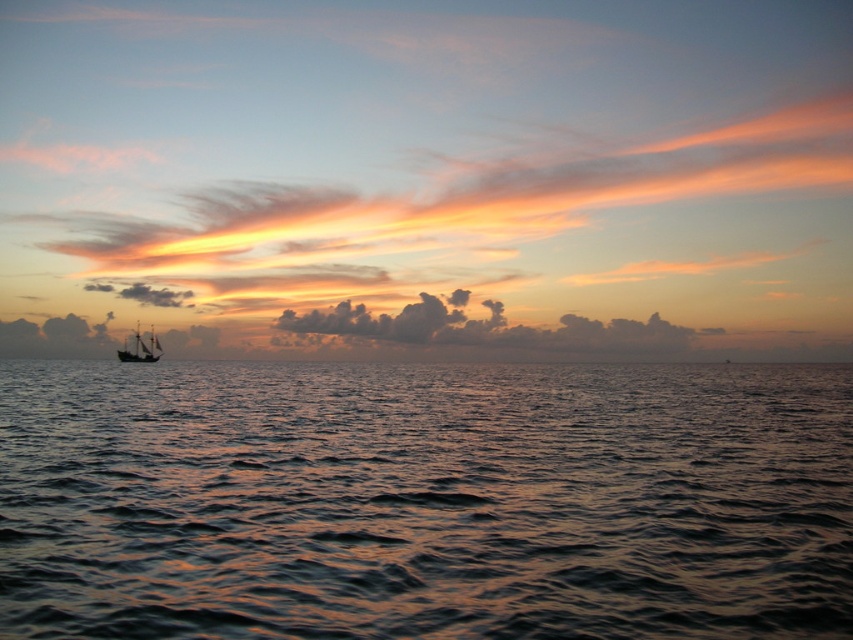
Who is shorter, glistening water at center or cloudy sky at center?

glistening water at center is shorter.

Is the position of glistening water at center less distant than that of cloudy sky at center?

Yes, it is.

The image size is (853, 640). In order to click on glistening water at center in this screenshot , I will do pyautogui.click(x=424, y=500).

Is point (3, 564) closer to camera compared to point (154, 348)?

Yes, point (3, 564) is in front of point (154, 348).

Is point (352, 589) farther from viewer compared to point (135, 362)?

No, (352, 589) is closer to viewer.

Locate an element on the screen. The width and height of the screenshot is (853, 640). glistening water at center is located at coordinates (424, 500).

Who is positioned more to the right, cloudy sky at center or wooden ship at left?

Positioned to the right is cloudy sky at center.

Is cloudy sky at center smaller than wooden ship at left?

Actually, cloudy sky at center might be larger than wooden ship at left.

Find the location of a particular element. cloudy sky at center is located at coordinates (485, 326).